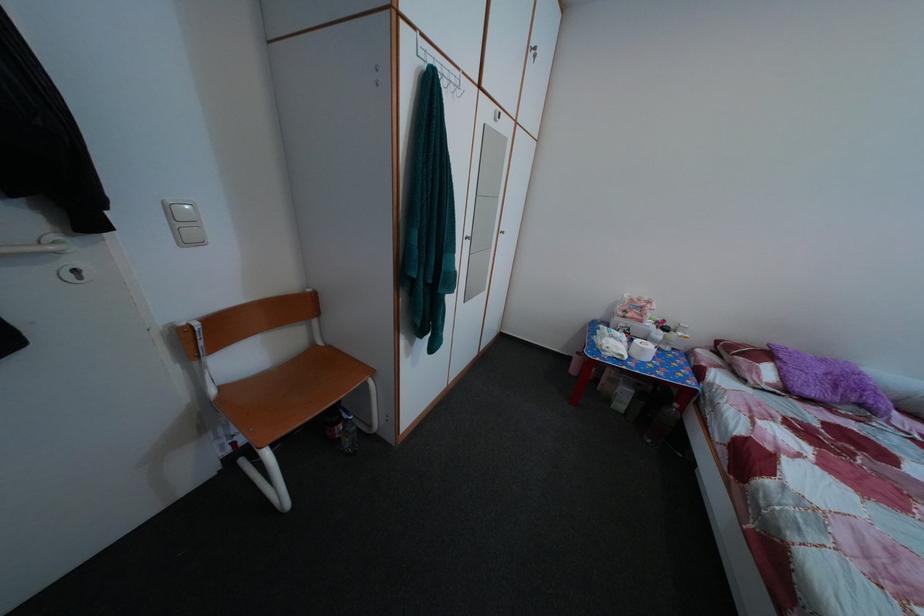
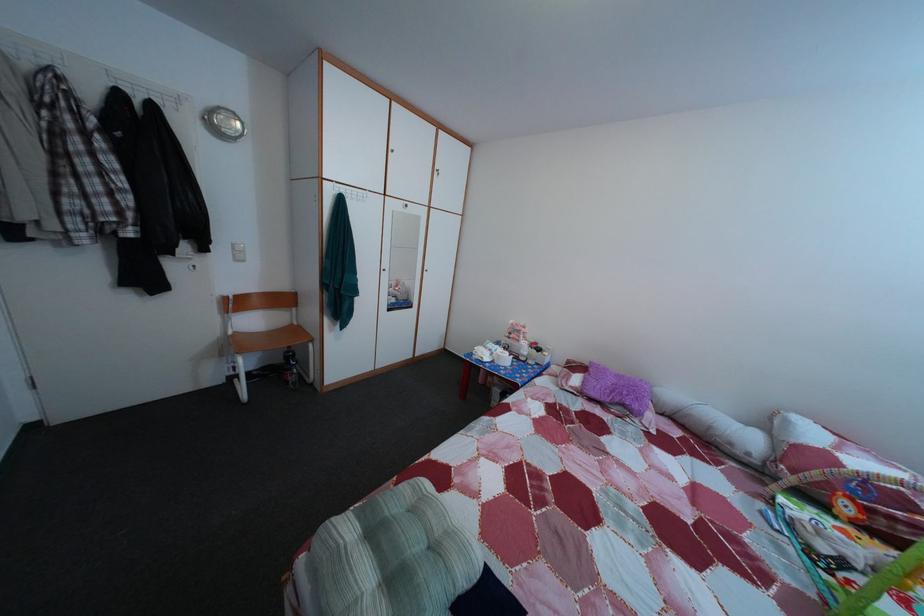
Where in the second image is the point corresponding to point 650,329 from the first image?

(528, 349)